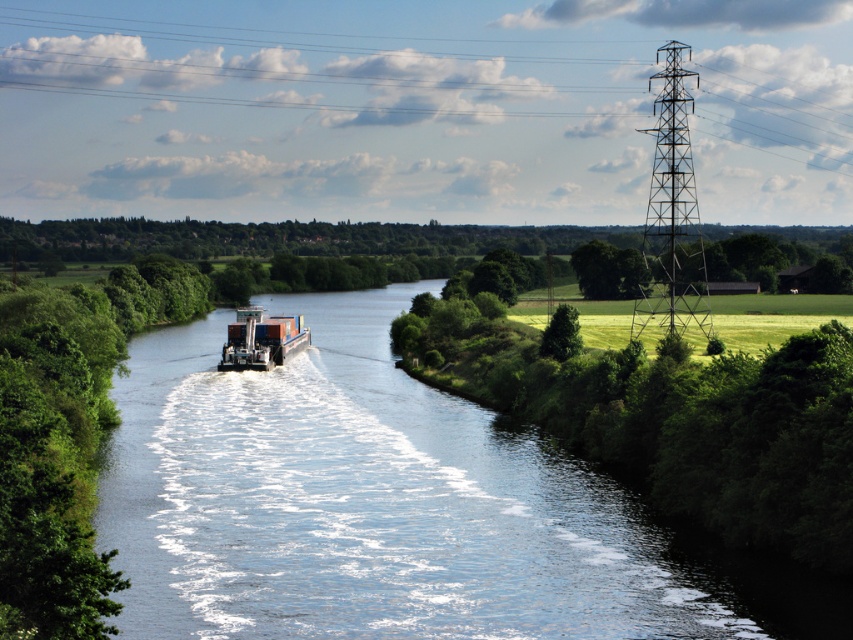
Question: Is clear blue water at center positioned before metallic container ship at center?

Choices:
 (A) yes
 (B) no

Answer: (A)

Question: Can you confirm if clear blue water at center is positioned below metallic container ship at center?

Choices:
 (A) no
 (B) yes

Answer: (B)

Question: Among these objects, which one is nearest to the camera?

Choices:
 (A) clear blue water at center
 (B) metallic tower at upper center
 (C) metallic container ship at center

Answer: (A)

Question: Is clear blue water at center further to the viewer compared to metallic tower at upper center?

Choices:
 (A) no
 (B) yes

Answer: (A)

Question: Considering the real-world distances, which object is farthest from the metallic container ship at center?

Choices:
 (A) clear blue water at center
 (B) metallic tower at upper center

Answer: (B)

Question: Considering the real-world distances, which object is closest to the metallic tower at upper center?

Choices:
 (A) metallic container ship at center
 (B) clear blue water at center

Answer: (B)